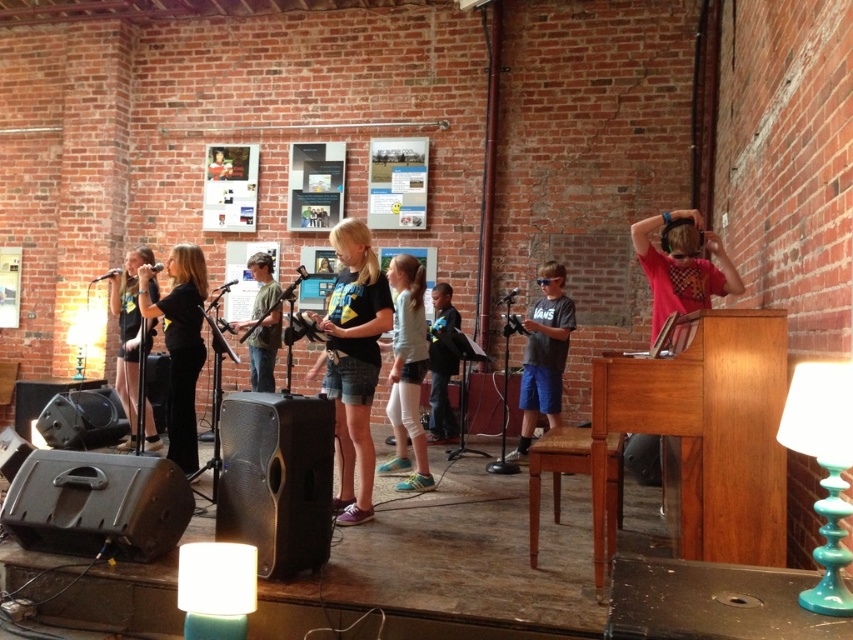
You are a photographer setting up for the performance. You need to ensure that the black matte shirt at center and the light brown wooden stool at center are both visible in your shot. Based on their heights, which one will appear larger in the photo?

The black matte shirt at center is taller than the light brown wooden stool at center, so it will appear larger in the photo.

You are a photographer setting up for the performance. You need to position your camera so that both the black matte shirt at center and the light brown wooden stool at center are in frame. Based on their positions, which object should be placed closer to the left side of the camera frame?

The black matte shirt at center is to the left of the light brown wooden stool at center, so the black matte shirt at center should be placed closer to the left side of the camera frame.